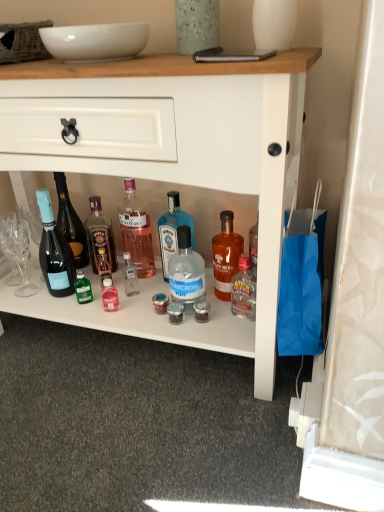
Question: Is white glossy cabinet at center located outside pink glass bottle at center, which is counted as the 4th bottle, starting from the right?

Choices:
 (A) no
 (B) yes

Answer: (B)

Question: Is white glossy cabinet at center thinner than pink glass bottle at center, which is counted as the 4th bottle, starting from the right?

Choices:
 (A) yes
 (B) no

Answer: (B)

Question: Does white glossy cabinet at center have a lesser height compared to pink glass bottle at center, which is counted as the 4th bottle, starting from the right?

Choices:
 (A) no
 (B) yes

Answer: (A)

Question: Is white glossy cabinet at center positioned in front of pink glass bottle at center, which is counted as the 4th bottle, starting from the right?

Choices:
 (A) no
 (B) yes

Answer: (B)

Question: From the image's perspective, does white glossy cabinet at center appear higher than pink glass bottle at center, which is counted as the third bottle, starting from the left?

Choices:
 (A) yes
 (B) no

Answer: (A)

Question: Can you confirm if white glossy cabinet at center is wider than pink glass bottle at center, which is counted as the third bottle, starting from the left?

Choices:
 (A) yes
 (B) no

Answer: (A)

Question: From a real-world perspective, does white glossy bowl at upper center stand above clear glass bottle at center, which is the second bottle from right to left?

Choices:
 (A) no
 (B) yes

Answer: (B)

Question: Considering the relative sizes of white glossy bowl at upper center and clear glass bottle at center, the 5th bottle when ordered from left to right, in the image provided, is white glossy bowl at upper center thinner than clear glass bottle at center, the 5th bottle when ordered from left to right,?

Choices:
 (A) no
 (B) yes

Answer: (A)

Question: From the image's perspective, does white glossy bowl at upper center appear lower than clear glass bottle at center, which is the second bottle from right to left?

Choices:
 (A) no
 (B) yes

Answer: (A)

Question: Is white glossy bowl at upper center oriented away from clear glass bottle at center, which is the second bottle from right to left?

Choices:
 (A) no
 (B) yes

Answer: (A)

Question: Is white glossy bowl at upper center wider than clear glass bottle at center, the 5th bottle when ordered from left to right?

Choices:
 (A) yes
 (B) no

Answer: (A)

Question: Is white glossy bowl at upper center taller than clear glass bottle at center, the 5th bottle when ordered from left to right?

Choices:
 (A) yes
 (B) no

Answer: (B)

Question: Is white glossy bowl at upper center taller than white glossy vase at upper center, the first glass vase in the right-to-left sequence?

Choices:
 (A) no
 (B) yes

Answer: (A)